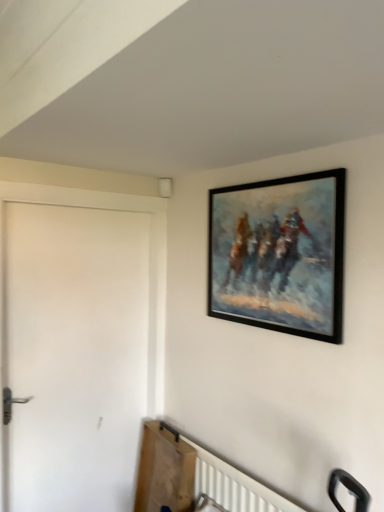
Question: Can we say black matte picture frame at upper right lies outside white matte door at left?

Choices:
 (A) yes
 (B) no

Answer: (A)

Question: Is black matte picture frame at upper right to the left of white matte door at left from the viewer's perspective?

Choices:
 (A) yes
 (B) no

Answer: (B)

Question: Is black matte picture frame at upper right further to the viewer compared to white matte door at left?

Choices:
 (A) no
 (B) yes

Answer: (A)

Question: Is there a large distance between black matte picture frame at upper right and white matte door at left?

Choices:
 (A) yes
 (B) no

Answer: (B)

Question: Considering the relative sizes of black matte picture frame at upper right and white matte door at left in the image provided, is black matte picture frame at upper right bigger than white matte door at left?

Choices:
 (A) no
 (B) yes

Answer: (A)

Question: Considering the relative sizes of black matte picture frame at upper right and white matte door at left in the image provided, is black matte picture frame at upper right thinner than white matte door at left?

Choices:
 (A) yes
 (B) no

Answer: (A)

Question: Considering the relative positions of white matte door at left and black matte picture frame at upper right in the image provided, is white matte door at left to the left of black matte picture frame at upper right from the viewer's perspective?

Choices:
 (A) yes
 (B) no

Answer: (A)

Question: Is white matte door at left facing towards black matte picture frame at upper right?

Choices:
 (A) no
 (B) yes

Answer: (B)

Question: Is white matte door at left shorter than black matte picture frame at upper right?

Choices:
 (A) no
 (B) yes

Answer: (A)

Question: Can you confirm if white matte door at left is taller than black matte picture frame at upper right?

Choices:
 (A) yes
 (B) no

Answer: (A)

Question: Considering the relative sizes of white matte door at left and black matte picture frame at upper right in the image provided, is white matte door at left smaller than black matte picture frame at upper right?

Choices:
 (A) yes
 (B) no

Answer: (B)

Question: Is white matte door at left not near black matte picture frame at upper right?

Choices:
 (A) yes
 (B) no

Answer: (B)

Question: Considering the positions of white matte door at left and black matte picture frame at upper right in the image, is white matte door at left bigger or smaller than black matte picture frame at upper right?

Choices:
 (A) big
 (B) small

Answer: (A)